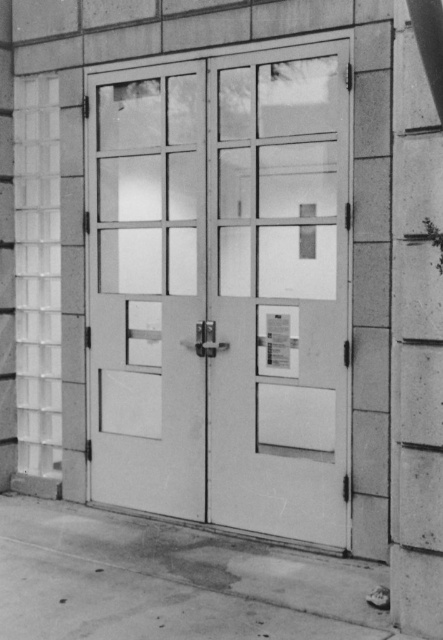
Between clear glass door at center and smooth concrete pillar at right, which one appears on the left side from the viewer's perspective?

Positioned to the left is clear glass door at center.

Does point (256, 157) come closer to viewer compared to point (420, 212)?

No, (256, 157) is further to viewer.

Who is more distant from viewer, (136, 426) or (400, 417)?

Answer: Point (136, 426)

The image size is (443, 640). Find the location of `clear glass door at center`. clear glass door at center is located at coordinates (222, 291).

Does clear glass door at center have a smaller size compared to matte glass door at center?

No.

Does clear glass door at center appear on the left side of matte glass door at center?

Incorrect, clear glass door at center is not on the left side of matte glass door at center.

The image size is (443, 640). Identify the location of clear glass door at center. (222, 291).

Is matte glass door at center bigger than smooth concrete pillar at right?

Correct, matte glass door at center is larger in size than smooth concrete pillar at right.

Is matte glass door at center shorter than smooth concrete pillar at right?

No, matte glass door at center is not shorter than smooth concrete pillar at right.

Between point (94, 93) and point (424, 554), which one is positioned behind?

The point (94, 93) is more distant.

At what (x,y) coordinates should I click in order to perform the action: click on matte glass door at center. Please return your answer as a coordinate pair (x, y). Looking at the image, I should click on (147, 291).